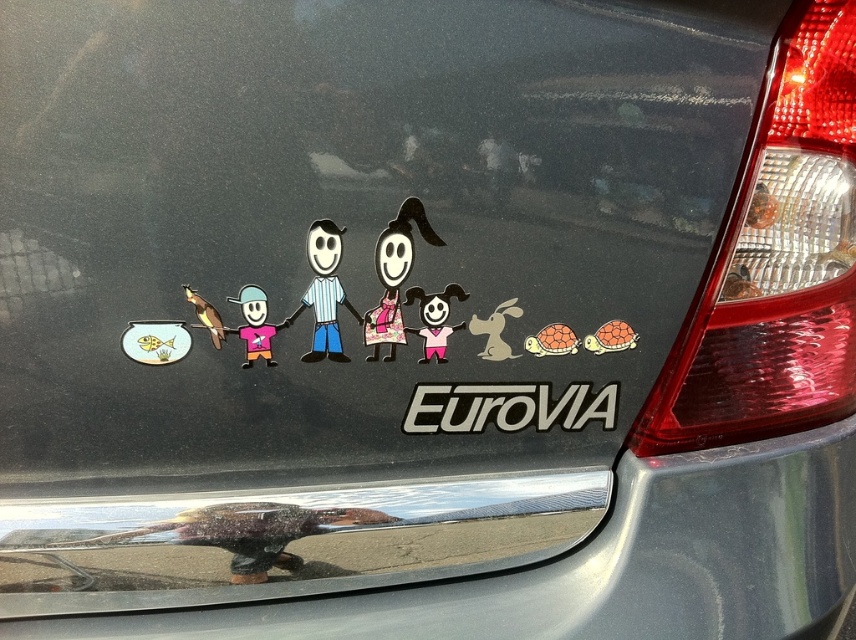
Who is positioned more to the left, matte black figure at center or matte pink shirt at center?

matte pink shirt at center is more to the left.

Which is behind, point (424, 348) or point (250, 340)?

Positioned behind is point (424, 348).

Image resolution: width=856 pixels, height=640 pixels. What do you see at coordinates (434, 320) in the screenshot? I see `matte black figure at center` at bounding box center [434, 320].

Where is `matte black figure at center`? matte black figure at center is located at coordinates (434, 320).

Is gold metallic fish at left in front of matte pink shirt at center?

That is False.

Between gold metallic fish at left and matte pink shirt at center, which one has more height?

matte pink shirt at center

Is point (144, 348) closer to camera compared to point (247, 344)?

Yes, point (144, 348) is closer to viewer.

Find the location of `gold metallic fish at left`. gold metallic fish at left is located at coordinates (155, 340).

Is matte plastic figure at center bigger than gold metallic fish at left?

Yes, matte plastic figure at center is bigger than gold metallic fish at left.

Which is in front, point (330, 310) or point (153, 358)?

Positioned in front is point (330, 310).

Locate an element on the screen. This screenshot has width=856, height=640. matte plastic figure at center is located at coordinates coord(324,291).